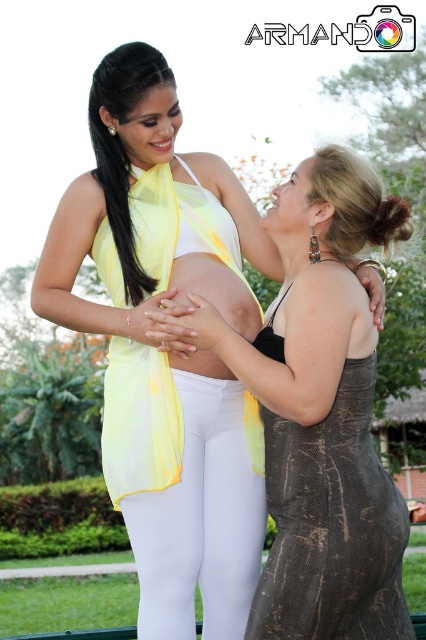
Looking at this image, you are a photographer standing in front of the two women in the image. You need to capture a closeup shot of both the white matte leggings at center and the matte yellow skin at center. Which object should you focus on first to ensure it appears sharp in the photo?

The white matte leggings at center is further to the viewer than the matte yellow skin at center, so you should focus on the white matte leggings at center first to ensure it appears sharp in the photo.

You are taking a photo of two women standing in front of you. You notice two points marked in the image at coordinates point (396,625) and point (227,600). Which point is closer to your camera?

Point (396,625) is closer to the camera than point (227,600).

You are standing at the point with coordinates point (192, 282) and want to walk towards the point with coordinates point (386, 506). According to the image, will you pass by the woman on the left or the woman on the right first?

According to the image, point (386, 506) is in front of point (192, 282). Therefore, when walking from point (192, 282) towards point (386, 506), you will first pass by the woman on the left.